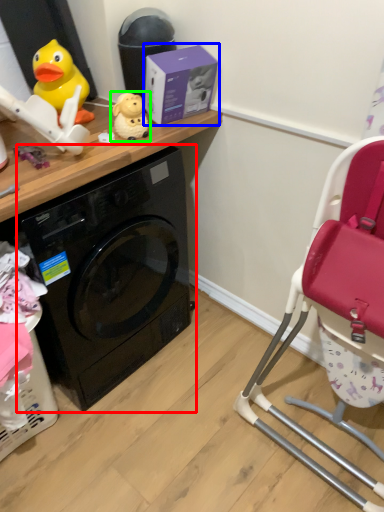
Question: Based on their relative distances, which object is nearer to washing machine (highlighted by a red box)? Choose from box (highlighted by a blue box) and toy (highlighted by a green box).

Choices:
 (A) box
 (B) toy

Answer: (A)